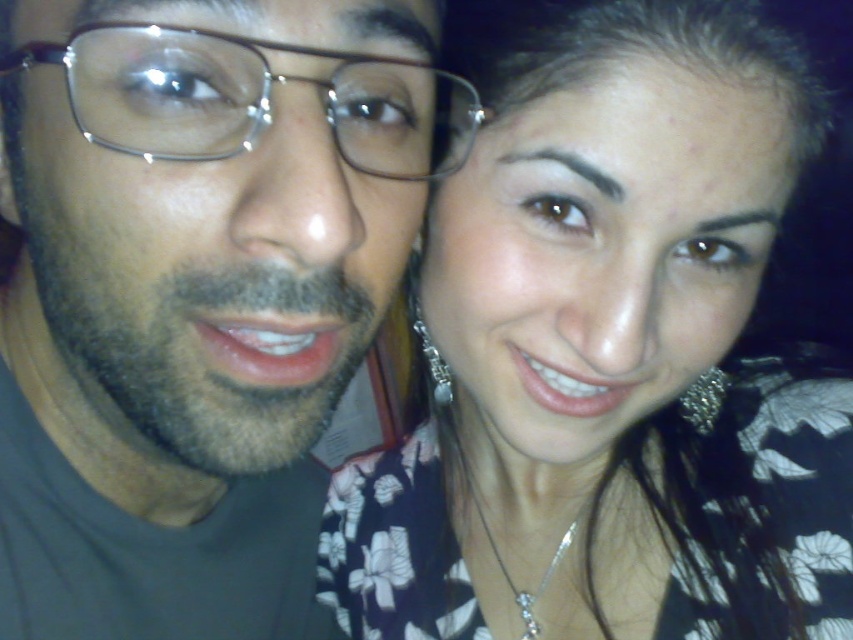
You are a photographer trying to adjust the lighting for a portrait. You notice a point at coordinates (610, 362) on the image. Based on the scene description, what is the purpose of this point?

The point at (610, 362) indicates the floral patterned blouse at center, so it is marking the location of the floral patterned blouse at center in the image.

You are using a photo editing software and want to place a sticker exactly at the center of the matte black face at left. The software shows coordinates from 0 to 1 on both axes. What coordinates should you input to position the sticker correctly?

The coordinates to place the sticker at the center of the matte black face at left are exactly at point 0.467 on the x axis and 0.225 on the y axis, as specified in the description.